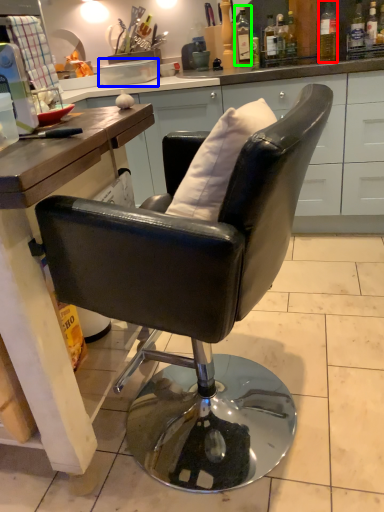
Question: Considering the real-world distances, which object is farthest from bottle (highlighted by a red box)? plate (highlighted by a blue box) or bottle (highlighted by a green box)?

Choices:
 (A) plate
 (B) bottle

Answer: (A)